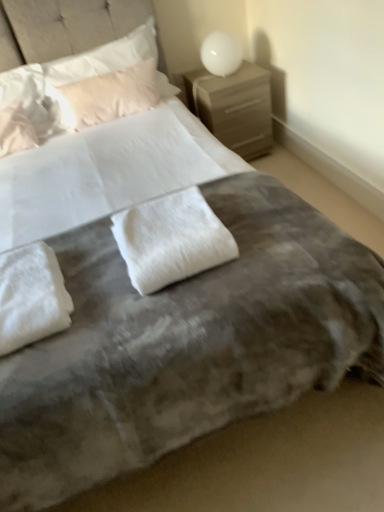
The height and width of the screenshot is (512, 384). What are the coordinates of `empty space that is ontop of matte beige nightstand at upper right (from a real-world perspective)` in the screenshot? It's located at (223, 78).